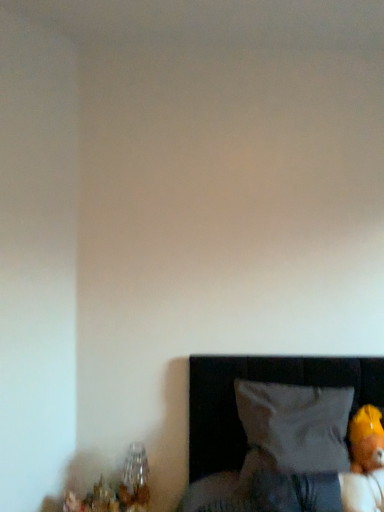
The height and width of the screenshot is (512, 384). Identify the location of soft yellow plush bear at lower right. (365, 463).

Describe the element at coordinates (134, 480) in the screenshot. The height and width of the screenshot is (512, 384). I see `clear glass vase at lower left` at that location.

Locate an element on the screen. The height and width of the screenshot is (512, 384). white fabric pillow at lower right is located at coordinates (297, 423).

Does point (258, 389) appear closer or farther from the camera than point (133, 480)?

Point (258, 389) appears to be closer to the viewer than point (133, 480).

Is white fabric pillow at lower right in front of or behind clear glass vase at lower left in the image?

white fabric pillow at lower right is in front of clear glass vase at lower left.

What's the angular difference between white fabric pillow at lower right and clear glass vase at lower left's facing directions?

white fabric pillow at lower right and clear glass vase at lower left are facing 1.34 degrees away from each other.

Where is `table lamp below the white fabric pillow at lower right (from the image's perspective)`? This screenshot has width=384, height=512. table lamp below the white fabric pillow at lower right (from the image's perspective) is located at coordinates (134, 480).

Is clear glass vase at lower left smaller than white fabric pillow at lower right?

Indeed, clear glass vase at lower left has a smaller size compared to white fabric pillow at lower right.

Is clear glass vase at lower left beside white fabric pillow at lower right?

No, clear glass vase at lower left is not in contact with white fabric pillow at lower right.

Which object is wider, clear glass vase at lower left or white fabric pillow at lower right?

Wider between the two is white fabric pillow at lower right.

From the picture: Is clear glass vase at lower left completely or partially outside of white fabric pillow at lower right?

clear glass vase at lower left is positioned outside white fabric pillow at lower right.

Between point (325, 447) and point (360, 430), which one is positioned in front?

The point (325, 447) is in front.

Looking at their sizes, would you say white fabric pillow at lower right is wider or thinner than soft yellow plush bear at lower right?

In the image, white fabric pillow at lower right appears to be wider than soft yellow plush bear at lower right.

In the image, is white fabric pillow at lower right positioned in front of or behind soft yellow plush bear at lower right?

In the image, white fabric pillow at lower right appears in front of soft yellow plush bear at lower right.

Is clear glass vase at lower left inside the boundaries of soft yellow plush bear at lower right, or outside?

clear glass vase at lower left lies outside soft yellow plush bear at lower right.

Could you tell me if clear glass vase at lower left is facing soft yellow plush bear at lower right?

No, clear glass vase at lower left is not facing towards soft yellow plush bear at lower right.

Which is in front, clear glass vase at lower left or soft yellow plush bear at lower right?

soft yellow plush bear at lower right is in front.

Between clear glass vase at lower left and soft yellow plush bear at lower right, which one has less height?

clear glass vase at lower left is shorter.

Considering the positions of objects soft yellow plush bear at lower right and clear glass vase at lower left in the image provided, who is in front, soft yellow plush bear at lower right or clear glass vase at lower left?

soft yellow plush bear at lower right is more forward.

From a real-world perspective, is soft yellow plush bear at lower right positioned over clear glass vase at lower left based on gravity?

Indeed, from a real-world perspective, soft yellow plush bear at lower right stands above clear glass vase at lower left.

Is soft yellow plush bear at lower right directly adjacent to white fabric pillow at lower right?

No.

Is soft yellow plush bear at lower right oriented away from white fabric pillow at lower right?

No, white fabric pillow at lower right is not at the back of soft yellow plush bear at lower right.

Who is more distant, soft yellow plush bear at lower right or white fabric pillow at lower right?

soft yellow plush bear at lower right is further away from the camera.

What's the angular difference between soft yellow plush bear at lower right and white fabric pillow at lower right's facing directions?

4.16 degrees separate the facing orientations of soft yellow plush bear at lower right and white fabric pillow at lower right.

In order to click on pillow in front of the clear glass vase at lower left in this screenshot , I will do `click(297, 423)`.

Locate an element on the screen. This screenshot has width=384, height=512. pillow that appears above the clear glass vase at lower left (from the image's perspective) is located at coordinates (297, 423).

In the scene shown: Based on their spatial positions, is white fabric pillow at lower right or clear glass vase at lower left further from soft yellow plush bear at lower right?

clear glass vase at lower left is positioned further to the anchor soft yellow plush bear at lower right.

When comparing their distances from white fabric pillow at lower right, does soft yellow plush bear at lower right or clear glass vase at lower left seem further?

Based on the image, clear glass vase at lower left appears to be further to white fabric pillow at lower right.

From the image, which object appears to be nearer to clear glass vase at lower left, soft yellow plush bear at lower right or white fabric pillow at lower right?

Based on the image, white fabric pillow at lower right appears to be nearer to clear glass vase at lower left.

Which object lies nearer to the anchor point soft yellow plush bear at lower right, clear glass vase at lower left or white fabric pillow at lower right?

Among the two, white fabric pillow at lower right is located nearer to soft yellow plush bear at lower right.

Considering their positions, is white fabric pillow at lower right positioned further to clear glass vase at lower left than soft yellow plush bear at lower right?

soft yellow plush bear at lower right lies further to clear glass vase at lower left than the other object.

From the image, which object appears to be farther from white fabric pillow at lower right, clear glass vase at lower left or soft yellow plush bear at lower right?

clear glass vase at lower left.

Where is `pillow situated between clear glass vase at lower left and soft yellow plush bear at lower right from left to right`? The width and height of the screenshot is (384, 512). pillow situated between clear glass vase at lower left and soft yellow plush bear at lower right from left to right is located at coordinates (297, 423).